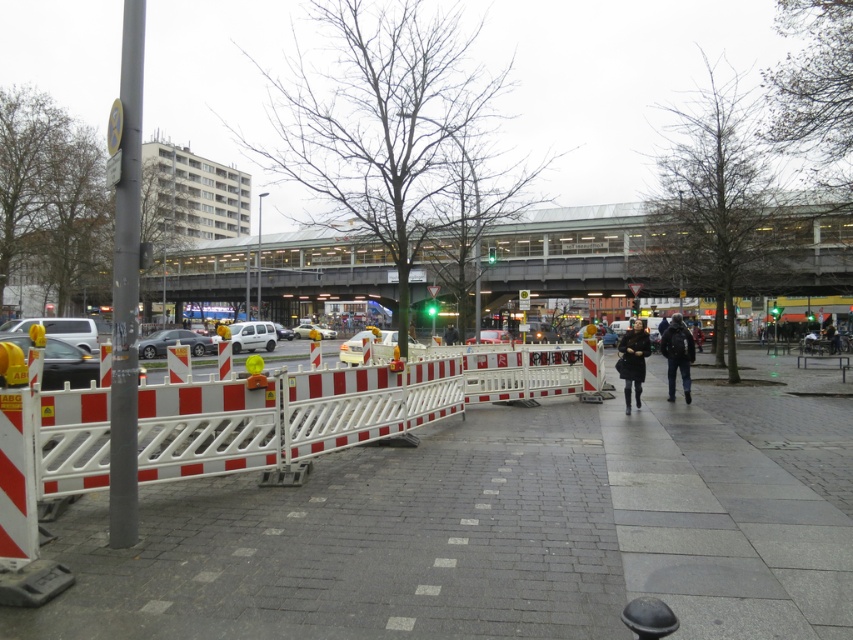
Which is behind, point (642, 371) or point (675, 356)?

Point (675, 356)

Does black fur coat at center appear on the right side of dark blue backpack at center?

Incorrect, black fur coat at center is not on the right side of dark blue backpack at center.

Is point (618, 364) positioned in front of point (680, 358)?

Yes, point (618, 364) is closer to viewer.

Identify the location of black fur coat at center. (631, 360).

Can you confirm if black fur coat at center is taller than white plastic car at center?

Yes.

Is black fur coat at center positioned at the back of white plastic car at center?

No, it is not.

Which is behind, point (634, 374) or point (416, 340)?

The point (416, 340) is more distant.

Where is `black fur coat at center`? black fur coat at center is located at coordinates (631, 360).

Looking at this image, is the position of black fur coat at center more distant than that of matte silver car at center?

That is False.

Is point (633, 342) farther from camera compared to point (312, 323)?

No.

Describe the element at coordinates (631, 360) in the screenshot. I see `black fur coat at center` at that location.

Where is `black fur coat at center`? The width and height of the screenshot is (853, 640). black fur coat at center is located at coordinates (631, 360).